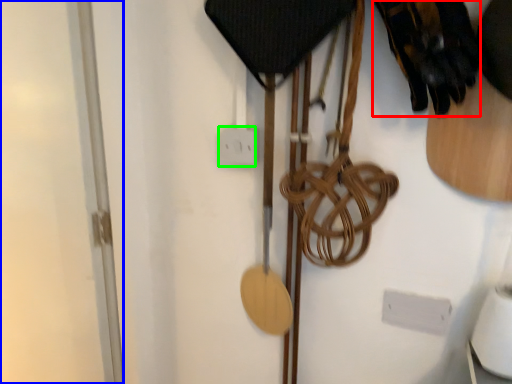
Question: Based on their relative distances, which object is nearer to footwear (highlighted by a red box)? Choose from glass door (highlighted by a blue box) and electric outlet (highlighted by a green box).

Choices:
 (A) glass door
 (B) electric outlet

Answer: (B)